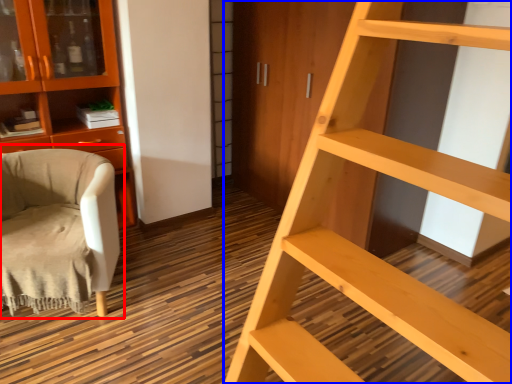
Question: Which object appears farthest to the camera in this image, chair (highlighted by a red box) or ladder (highlighted by a blue box)?

Choices:
 (A) chair
 (B) ladder

Answer: (A)